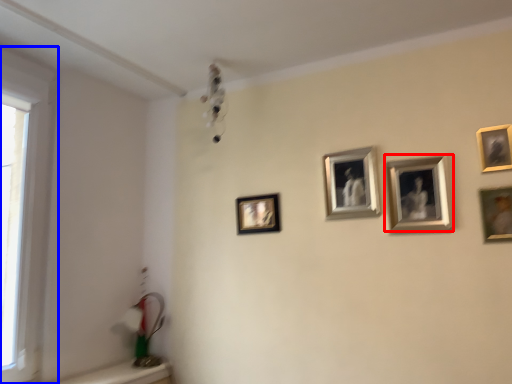
Question: Which object appears farthest to the camera in this image, picture frame (highlighted by a red box) or window (highlighted by a blue box)?

Choices:
 (A) picture frame
 (B) window

Answer: (A)